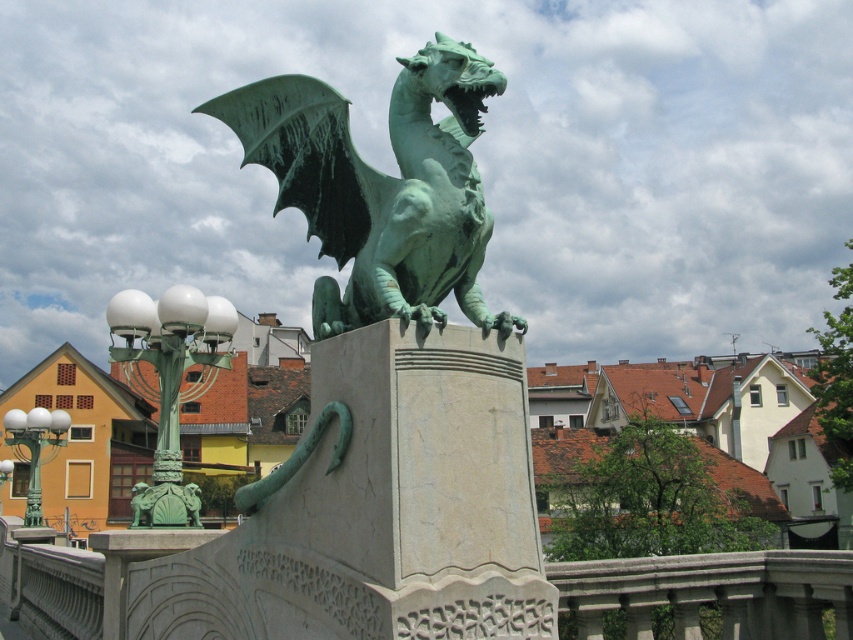
Between green matte lamp post at left and green glass lamp post at left, which one is positioned higher?

green matte lamp post at left is higher up.

Does green matte lamp post at left have a lesser height compared to green glass lamp post at left?

No, green matte lamp post at left is not shorter than green glass lamp post at left.

Is point (126, 305) farther from viewer compared to point (1, 470)?

No, it is not.

Locate an element on the screen. The height and width of the screenshot is (640, 853). green matte lamp post at left is located at coordinates (169, 381).

Where is `green patina dragon at center`? green patina dragon at center is located at coordinates (381, 188).

Measure the distance between green patina dragon at center and green glass lamp post at left.

110.93 feet

Is point (350, 236) farther from camera compared to point (4, 461)?

No.

You are a GUI agent. You are given a task and a screenshot of the screen. Output one action in this format:
    pyautogui.click(x=<x>, y=<y>)
    Task: Click on the green patina dragon at center
    The image size is (853, 640).
    Given the screenshot: What is the action you would take?
    pyautogui.click(x=381, y=188)

Who is positioned more to the right, green matte lamp post at left or green metal/bronze lamp post at lower left?

Positioned to the right is green matte lamp post at left.

Based on the photo, which is below, green matte lamp post at left or green metal/bronze lamp post at lower left?

green metal/bronze lamp post at lower left is below.

Is point (171, 381) farther from viewer compared to point (44, 420)?

No, it is in front of (44, 420).

Where is `green matte lamp post at left`? The height and width of the screenshot is (640, 853). green matte lamp post at left is located at coordinates (169, 381).